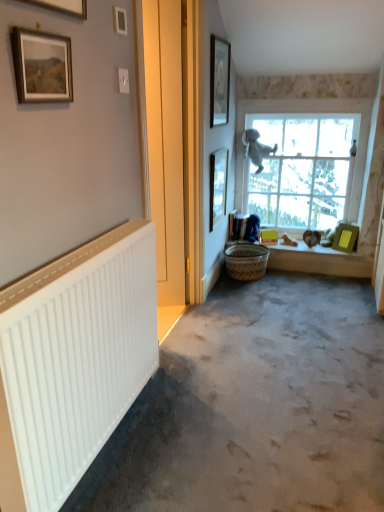
Question: From the image's perspective, is matte gold picture frame at upper left, the 6th picture frame viewed from the back, above or below green matte picture frame at right, positioned as the 1th picture frame in back-to-front order?

Choices:
 (A) below
 (B) above

Answer: (B)

Question: Looking at their shapes, would you say matte gold picture frame at upper left, marked as the first picture frame in a front-to-back arrangement, is wider or thinner than green matte picture frame at right, marked as the sixth picture frame in a left-to-right arrangement?

Choices:
 (A) wide
 (B) thin

Answer: (B)

Question: Which is nearer to the white matte radiator at left?

Choices:
 (A) woven brown basket at lower center
 (B) white plastic radiator at left
 (C) matte white picture frame at upper center, the 3th picture frame when ordered from front to back
 (D) green matte picture frame at right, which ranks as the first picture frame in right-to-left order
 (E) matte wooden picture frame at upper center, which is the third picture frame from right to left

Answer: (B)

Question: Considering the real-world distances, which object is farthest from the white matte radiator at left?

Choices:
 (A) matte gold picture frame at upper left, which ranks as the 1th picture frame in left-to-right order
 (B) wooden framed painting at upper left, the 2th picture frame from the front
 (C) matte black picture frame at right, which is the 5th picture frame from left to right
 (D) matte white picture frame at upper center, the 3th picture frame when ordered from front to back
 (E) matte wooden picture frame at upper center, which is the third picture frame from right to left

Answer: (E)